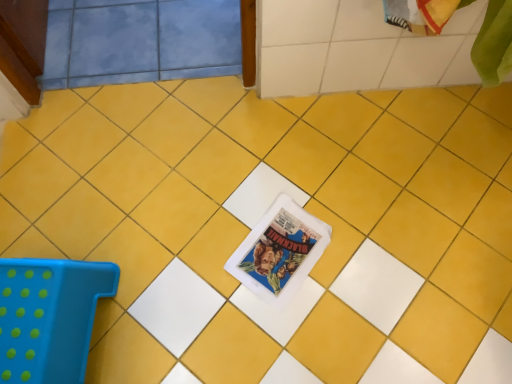
Locate an element on the screen. vacant area on top of matte plastic comic book at center (from a real-world perspective) is located at coordinates (282, 251).